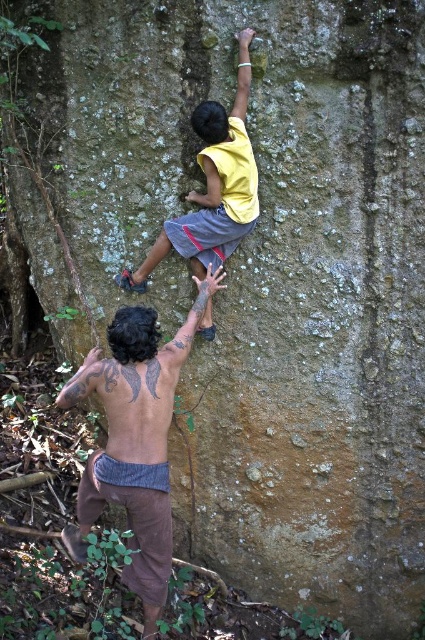
You are a safety observer at the climbing site. You notice the brown textured shorts at lower left and the yellow matte shirt at upper center. Based on their positions, which one is closer to the ground?

The brown textured shorts at lower left is positioned under the yellow matte shirt at upper center, so it is closer to the ground.

You are a rock climbing instructor observing the scene. You notice two climbers. The climber at the bottom is wearing brown textured shorts at lower left, and the one above is wearing a yellow matte shirt at upper center. Which climber has a wider lower body garment?

The brown textured shorts at lower left has a larger width than the yellow matte shirt at upper center, so the climber at the bottom wearing brown textured shorts at lower left has a wider lower body garment.